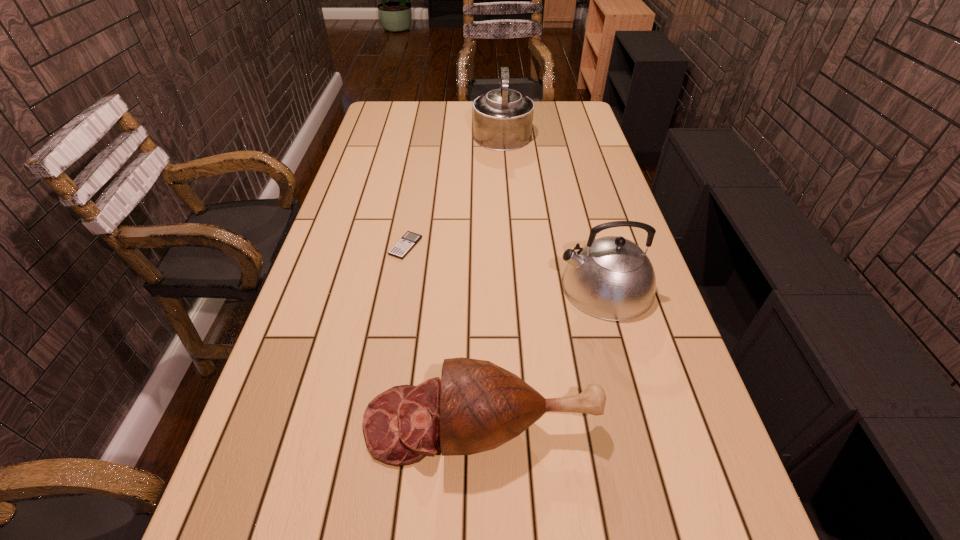
Where is `vacant space at the far left corner of the desktop`? vacant space at the far left corner of the desktop is located at coordinates (385, 108).

This screenshot has height=540, width=960. In the image, there is a desktop. What are the coordinates of `free region at the far right corner` in the screenshot? It's located at (553, 125).

Locate an element on the screen. The height and width of the screenshot is (540, 960). free spot between the nearer kettle and the calculator is located at coordinates (506, 266).

I want to click on free spot between the shortest object and the tallest object, so pos(454,189).

Where is `free space between the tallest object and the second tallest object`? The image size is (960, 540). free space between the tallest object and the second tallest object is located at coordinates (554, 209).

Identify the location of empty space between the ham and the second tallest object. The width and height of the screenshot is (960, 540). (543, 355).

Where is `empty space between the farther kettle and the third tallest object`? empty space between the farther kettle and the third tallest object is located at coordinates (492, 278).

Find the location of a particular element. This screenshot has height=540, width=960. unoccupied area between the third shortest object and the shortest object is located at coordinates (506, 266).

Find the location of a particular element. This screenshot has width=960, height=540. free area in between the calculator and the shorter kettle is located at coordinates (506, 266).

At what (x,y) coordinates should I click in order to perform the action: click on vacant space that's between the shortest object and the taller kettle. Please return your answer as a coordinate pair (x, y). Looking at the image, I should click on (454, 189).